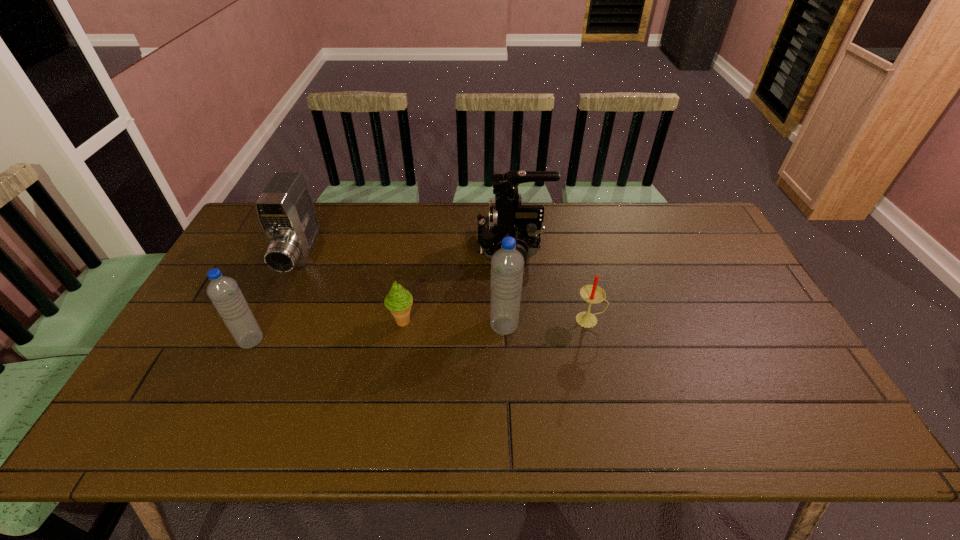
The image size is (960, 540). I want to click on the shorter water bottle, so click(x=224, y=292).

You are a GUI agent. You are given a task and a screenshot of the screen. Output one action in this format:
    pyautogui.click(x=<x>, y=<y>)
    Task: Click on the taller water bottle
    Image resolution: width=960 pixels, height=540 pixels.
    Given the screenshot: What is the action you would take?
    pyautogui.click(x=507, y=264)

Locate an element on the screen. the taller camcorder is located at coordinates (507, 217).

Image resolution: width=960 pixels, height=540 pixels. What are the coordinates of `the shorter camcorder` in the screenshot? It's located at (285, 209).

This screenshot has height=540, width=960. I want to click on the rightmost object, so click(592, 294).

Identify the location of icecream. This screenshot has height=540, width=960. (399, 300).

Identify the location of vacant space located 0.370m on the right of the shorter water bottle. This screenshot has height=540, width=960. (403, 340).

The image size is (960, 540). In order to click on vacant space situated on the back of the right water bottle in this screenshot , I will do `click(501, 266)`.

Find the location of a particular element. This screenshot has width=960, height=540. vacant space located on the lens mount of the taller camcorder is located at coordinates (x=452, y=248).

This screenshot has height=540, width=960. Identify the location of vacant region located on the lens mount of the taller camcorder. (409, 248).